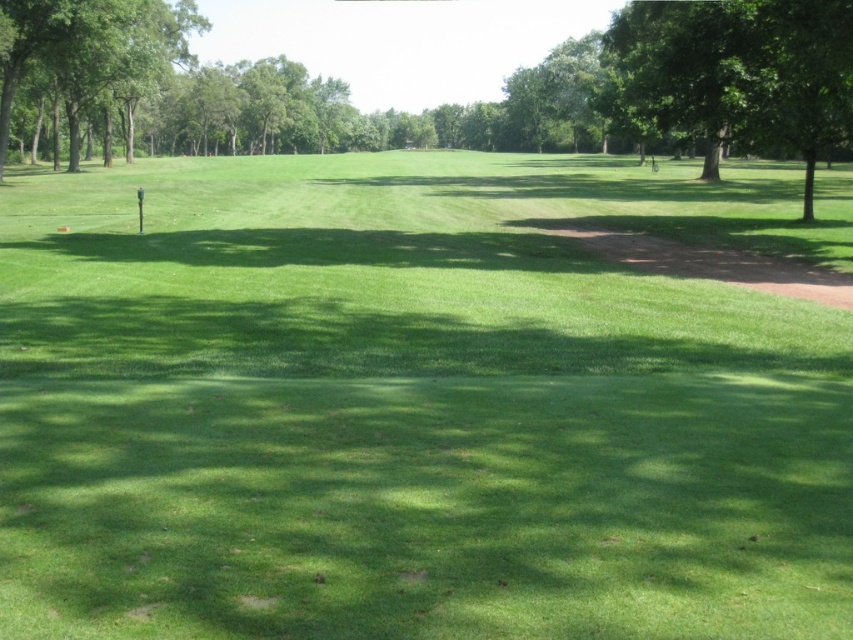
Does green leafy tree at upper right appear on the right side of green leafy tree at upper left?

Indeed, green leafy tree at upper right is positioned on the right side of green leafy tree at upper left.

Where is `green leafy tree at upper right`? green leafy tree at upper right is located at coordinates (737, 72).